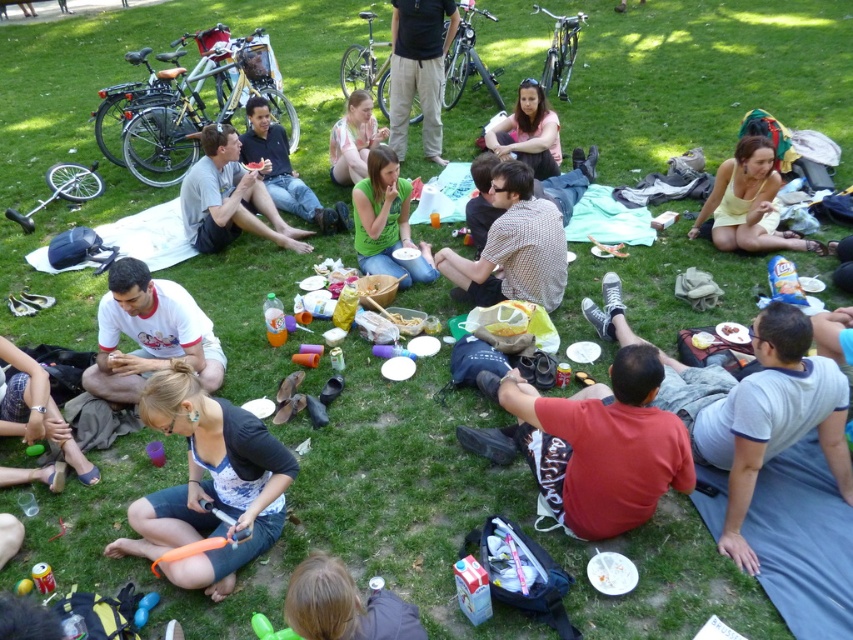
Does yellow cotton dress at lower right lie in front of green matte shirt at center?

Yes, it is.

Image resolution: width=853 pixels, height=640 pixels. Identify the location of yellow cotton dress at lower right. (747, 204).

Is orange rubber balloon at lower center in front of matte pink shirt at center?

Yes, it is in front of matte pink shirt at center.

Which is more to the right, orange rubber balloon at lower center or matte pink shirt at center?

matte pink shirt at center is more to the right.

Between point (213, 593) and point (527, 134), which one is positioned in front?

Positioned in front is point (213, 593).

Identify the location of orange rubber balloon at lower center. (207, 484).

What do you see at coordinates (514, 246) in the screenshot?
I see `checkered fabric shirt at center` at bounding box center [514, 246].

Does checkered fabric shirt at center come behind light pink fabric at center?

No, it is in front of light pink fabric at center.

Is point (490, 296) closer to viewer compared to point (335, 131)?

Yes, point (490, 296) is closer to viewer.

Identify the location of checkered fabric shirt at center. (514, 246).